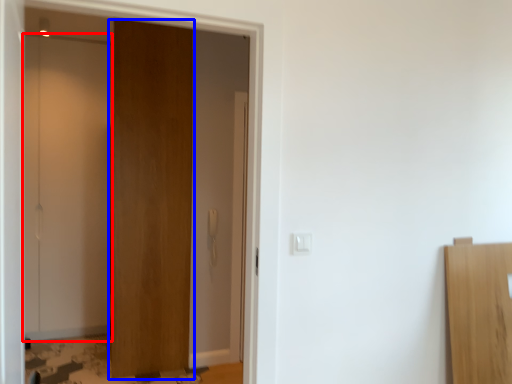
Question: Which object is further to the camera taking this photo, door (highlighted by a red box) or door (highlighted by a blue box)?

Choices:
 (A) door
 (B) door

Answer: (A)